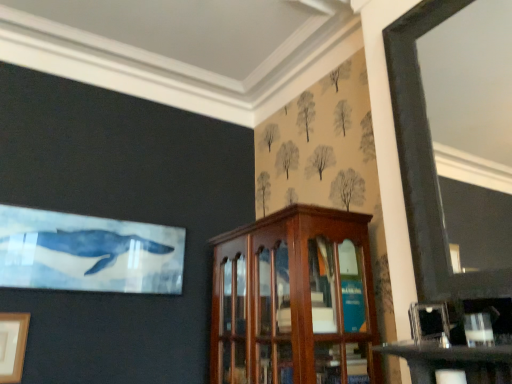
Question: Is wooden picture frame at lower left, positioned as the 1th picture frame in back-to-front order, inside or outside of mahogany wood cabinet at center?

Choices:
 (A) outside
 (B) inside

Answer: (A)

Question: Is point (25, 347) positioned closer to the camera than point (264, 369)?

Choices:
 (A) farther
 (B) closer

Answer: (A)

Question: Which is farther from the mahogany wood cabinet at center?

Choices:
 (A) wooden picture frame at lower left, acting as the 2th picture frame starting from the front
 (B) metallic silver picture frame at lower right, which is the second picture frame in left-to-right order

Answer: (A)

Question: Which object is positioned closest to the wooden picture frame at lower left, positioned as the 1th picture frame in back-to-front order?

Choices:
 (A) mahogany wood cabinet at center
 (B) metallic silver picture frame at lower right, which is the 2th picture frame in bottom-to-top order

Answer: (A)